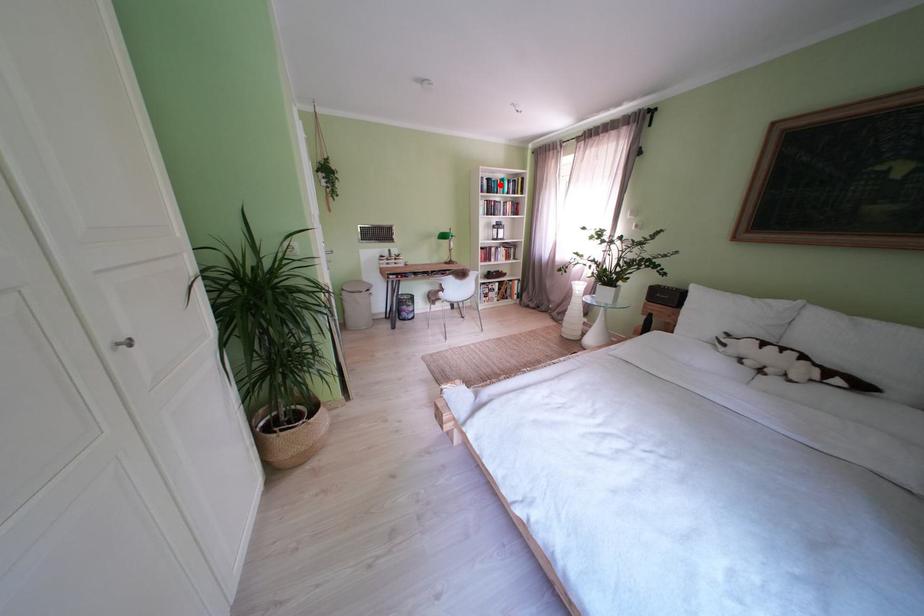
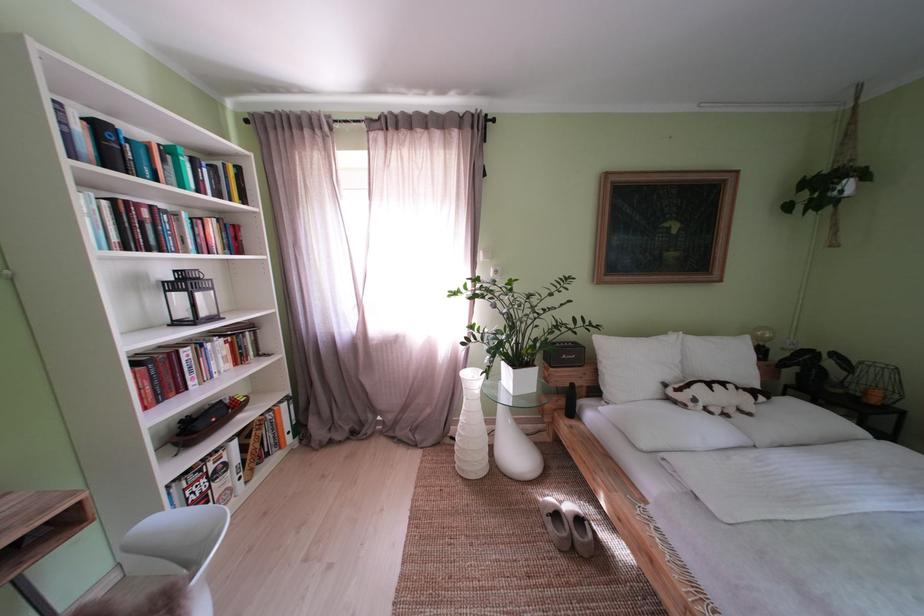
Question: I am providing you with two images of the same scene from different viewpoints. In image1, a red point is highlighted. Considering the same 3D point in image2, which of the following is correct?

Choices:
 (A) It is closer
 (B) It is farther

Answer: (B)